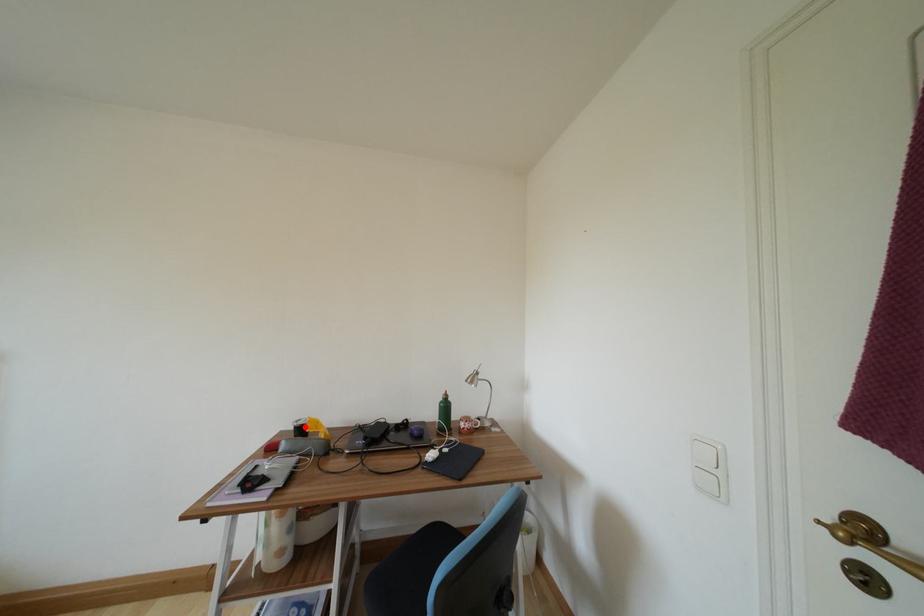
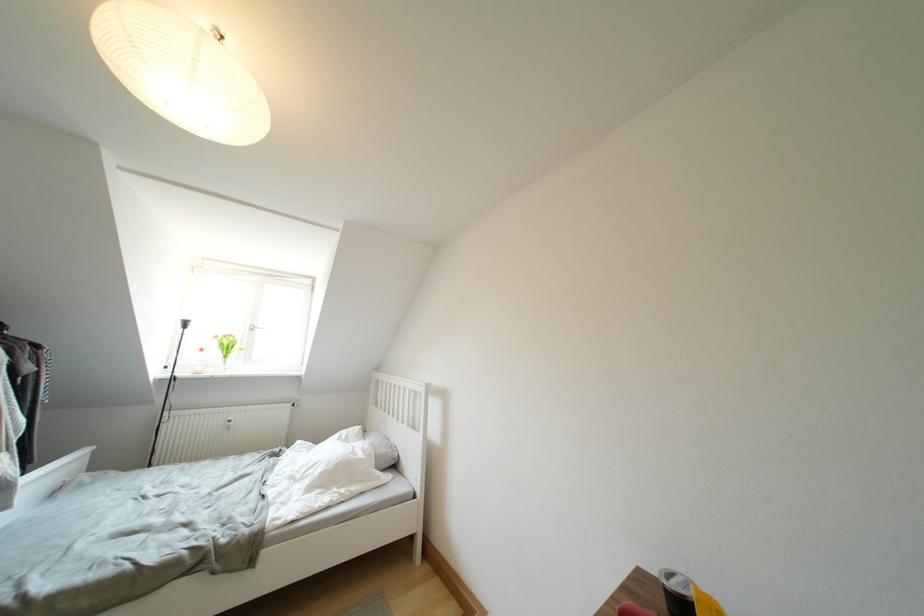
In the second image, find the point that corresponds to the highlighted location in the first image.

(678, 589)